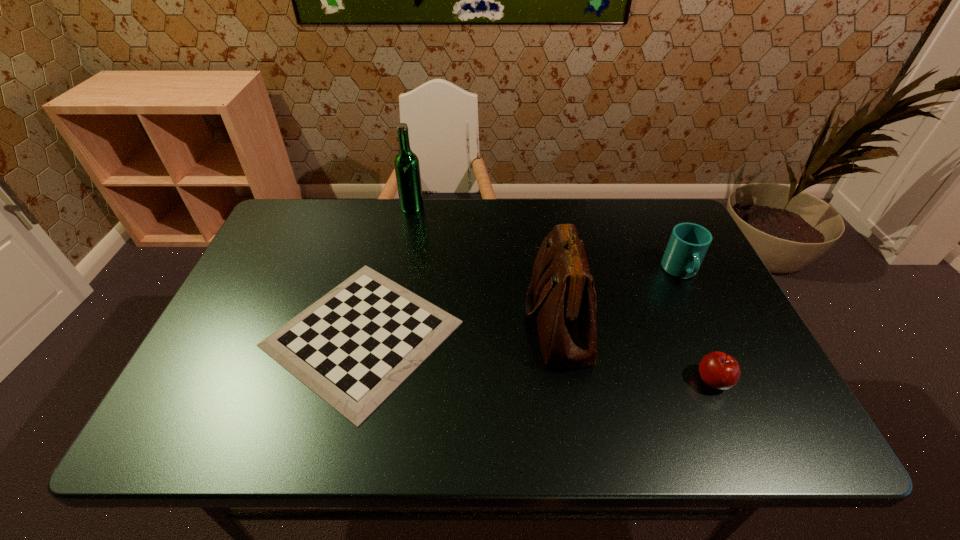
Identify the location of vacant space that is in between the third object from right to left and the cup. The width and height of the screenshot is (960, 540). (620, 293).

Locate an element on the screen. The height and width of the screenshot is (540, 960). empty location between the second shortest object and the shoulder bag is located at coordinates (636, 347).

Locate an element on the screen. The height and width of the screenshot is (540, 960). free spot between the apple and the third object from right to left is located at coordinates (636, 347).

Locate an element on the screen. This screenshot has height=540, width=960. vacant area that lies between the cup and the apple is located at coordinates (697, 326).

Locate an element on the screen. vacant space that's between the second shortest object and the cup is located at coordinates (697, 326).

Identify the location of unoccupied position between the beer bottle and the third object from right to left. (486, 261).

You are a GUI agent. You are given a task and a screenshot of the screen. Output one action in this format:
    pyautogui.click(x=<x>, y=<y>)
    Task: Click on the vacant point located between the third object from right to left and the cup
    The width and height of the screenshot is (960, 540).
    Given the screenshot: What is the action you would take?
    pyautogui.click(x=620, y=293)

This screenshot has height=540, width=960. In order to click on free area in between the third object from right to left and the beer bottle in this screenshot , I will do `click(486, 261)`.

This screenshot has height=540, width=960. Find the location of `object that can be found as the closest to the chessboard`. object that can be found as the closest to the chessboard is located at coordinates (561, 295).

Where is `object that can be found as the closest to the apple`? The width and height of the screenshot is (960, 540). object that can be found as the closest to the apple is located at coordinates (561, 295).